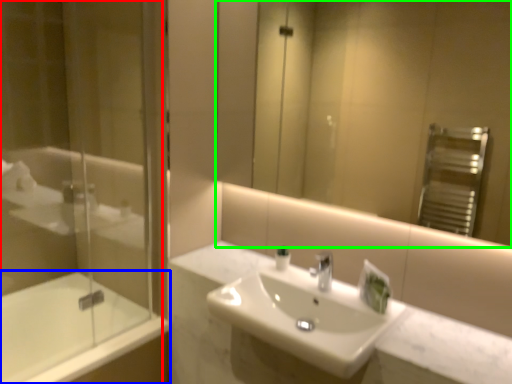
Question: Which object is the closest to the shower door (highlighted by a red box)? Choose among these: bathtub (highlighted by a blue box) or mirror (highlighted by a green box).

Choices:
 (A) bathtub
 (B) mirror

Answer: (A)